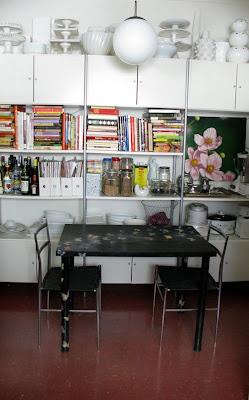
Identify the location of red formica flooring. (148, 374).